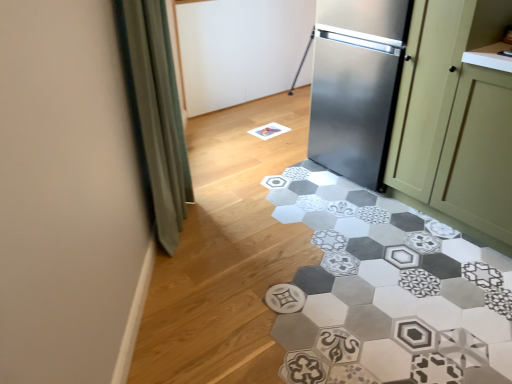
Locate an element on the screen. The image size is (512, 384). vacant position to the left of stainless steel cabinet at right is located at coordinates (286, 187).